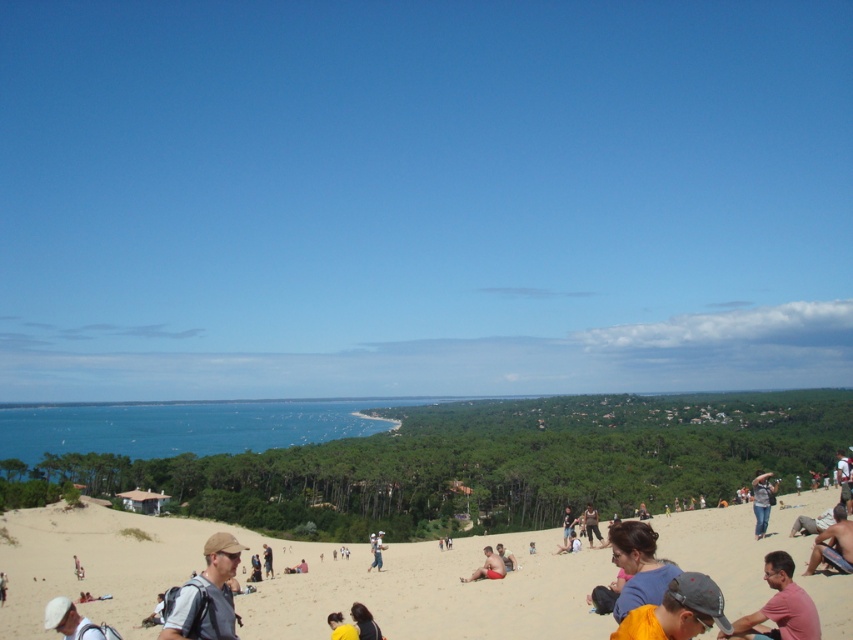
Does yellow fabric cap at lower right have a larger size compared to dark brown hair at lower center?

Yes, yellow fabric cap at lower right is bigger than dark brown hair at lower center.

Which is above, yellow fabric cap at lower right or dark brown hair at lower center?

yellow fabric cap at lower right

The height and width of the screenshot is (640, 853). I want to click on yellow fabric cap at lower right, so (x=677, y=611).

This screenshot has height=640, width=853. Describe the element at coordinates (486, 566) in the screenshot. I see `red fabric shorts at center` at that location.

Does red fabric shorts at center have a greater width compared to light brown sand at lower center?

Incorrect, red fabric shorts at center's width does not surpass light brown sand at lower center's.

Does point (497, 573) come farther from viewer compared to point (566, 538)?

That is False.

Where is `red fabric shorts at center`? red fabric shorts at center is located at coordinates (486, 566).

Is pink cotton shirt at lower right to the left of red fabric shorts at center from the viewer's perspective?

Incorrect, pink cotton shirt at lower right is not on the left side of red fabric shorts at center.

Which is more to the left, pink cotton shirt at lower right or red fabric shorts at center?

red fabric shorts at center

Locate an element on the screen. This screenshot has height=640, width=853. pink cotton shirt at lower right is located at coordinates (779, 605).

Identify the location of pink cotton shirt at lower right. (779, 605).